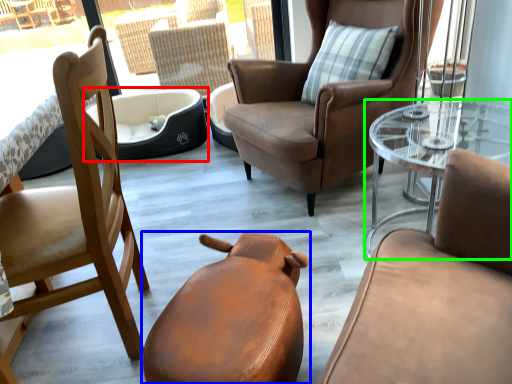
Question: Considering the real-world distances, which object is farthest from dog bed (highlighted by a red box)? chair (highlighted by a blue box) or coffee table (highlighted by a green box)?

Choices:
 (A) chair
 (B) coffee table

Answer: (A)